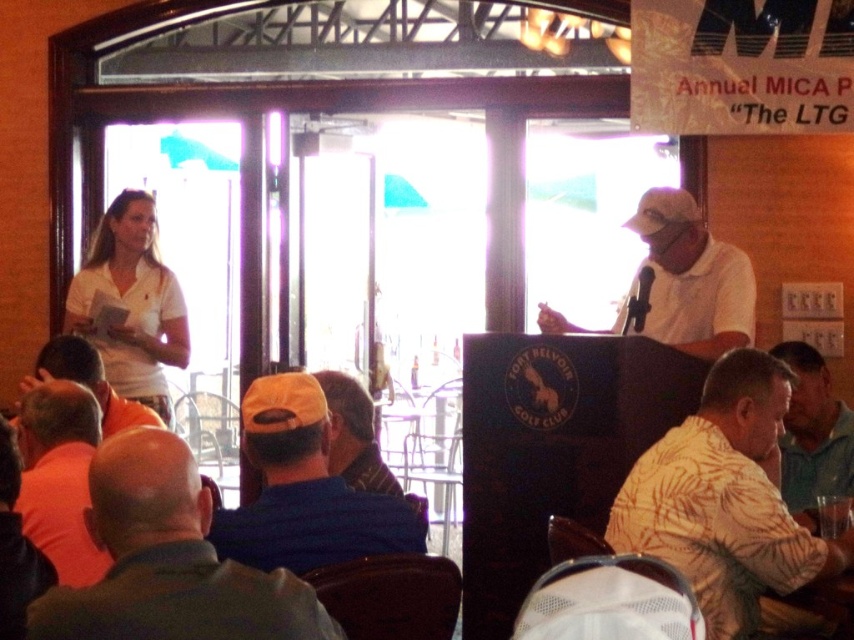
Question: Observing the image, what is the correct spatial positioning of green fabric shirt at lower right in reference to orange knit cap at center?

Choices:
 (A) below
 (B) above

Answer: (A)

Question: Which object appears closest to the camera in this image?

Choices:
 (A) green fabric shirt at lower right
 (B) white matte shirt at left

Answer: (A)

Question: Does green fabric shirt at lower right appear on the left side of orange shirt at lower left?

Choices:
 (A) yes
 (B) no

Answer: (B)

Question: Which point is closer to the camera?

Choices:
 (A) (208, 579)
 (B) (60, 564)

Answer: (A)

Question: Does yellow floral shirt at lower right have a greater width compared to green fabric shirt at lower right?

Choices:
 (A) no
 (B) yes

Answer: (B)

Question: Estimate the real-world distances between objects in this image. Which object is farther from the white matte shirt at center?

Choices:
 (A) gray fabric jacket at lower left
 (B) green fabric shirt at lower right

Answer: (A)